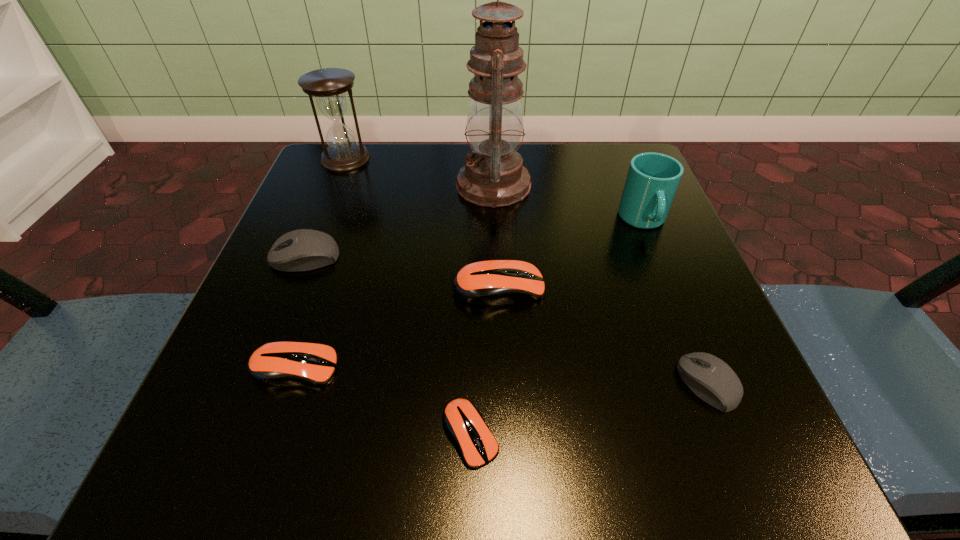
This screenshot has width=960, height=540. I want to click on free space at the left edge, so click(204, 403).

I want to click on vacant space at the right edge of the desktop, so click(645, 285).

Where is `vacant space at the far left corner of the desktop`? Image resolution: width=960 pixels, height=540 pixels. vacant space at the far left corner of the desktop is located at coordinates (305, 204).

In the image, there is a desktop. Where is `vacant area at the near left corner`? Image resolution: width=960 pixels, height=540 pixels. vacant area at the near left corner is located at coordinates (x=197, y=439).

Identify the location of vacant area at the far right corner. (595, 168).

Where is `vacant space in between the bigger black computer equipment and the smaller black computer equipment`? vacant space in between the bigger black computer equipment and the smaller black computer equipment is located at coordinates (506, 320).

The height and width of the screenshot is (540, 960). Identify the location of free spot between the tallest object and the bigger black computer equipment. (399, 221).

Find the location of a particular element. This screenshot has width=960, height=540. empty space that is in between the farthest orange computer mouse and the leftmost orange computer mouse is located at coordinates (396, 328).

Where is `vacant region between the biggest orange computer mouse and the smallest orange computer mouse`? vacant region between the biggest orange computer mouse and the smallest orange computer mouse is located at coordinates (485, 361).

I want to click on free space between the bigger black computer equipment and the rightmost computer mouse, so click(506, 320).